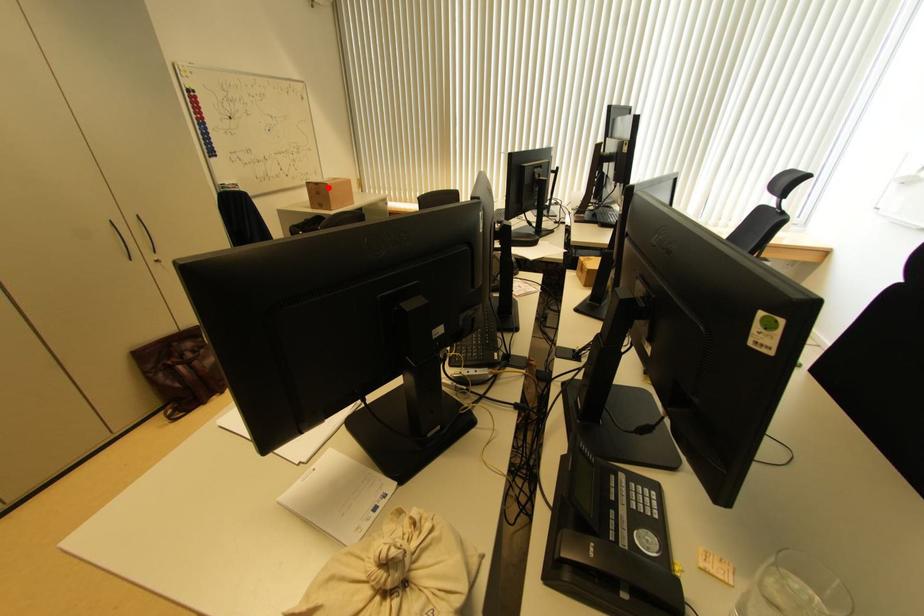
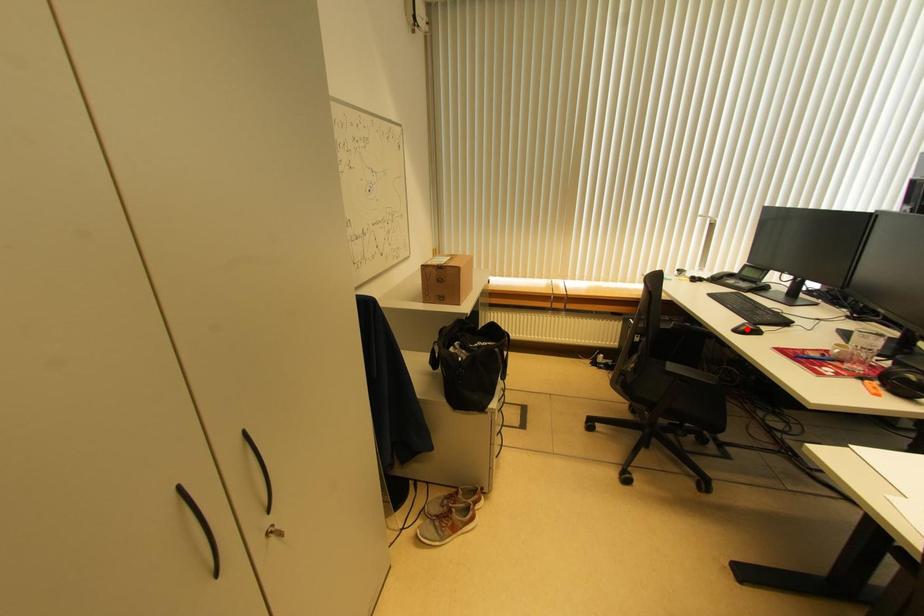
I am providing you with two images of the same scene from different viewpoints. A red point is marked on the first image and another point is marked on the second image. Are the points marked in image1 and image2 representing the same 3D position?

No